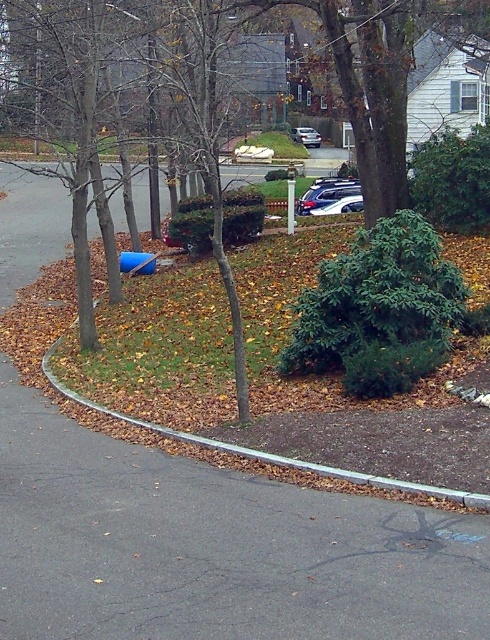
Does gray concrete curb at lower center have a lesser width compared to satin silver sedan at upper center?

No.

Is gray concrete curb at lower center behind satin silver sedan at upper center?

That is False.

Measure the distance between point (456,497) and camera.

29.93 feet

Find the location of a particular element. gray concrete curb at lower center is located at coordinates (265, 451).

Measure the distance between green leafy tree at center and satin silver suv at center.

10.79 meters

Between green leafy tree at center and satin silver suv at center, which one appears on the left side from the viewer's perspective?

green leafy tree at center is more to the left.

Find the location of a particular element. The width and height of the screenshot is (490, 640). green leafy tree at center is located at coordinates (367, 88).

Does brown textured tree at center have a larger size compared to satin silver sedan at upper center?

Correct, brown textured tree at center is larger in size than satin silver sedan at upper center.

Who is more forward, (394, 156) or (295, 132)?

Point (394, 156) is more forward.

Locate an element on the screen. The width and height of the screenshot is (490, 640). brown textured tree at center is located at coordinates (197, 102).